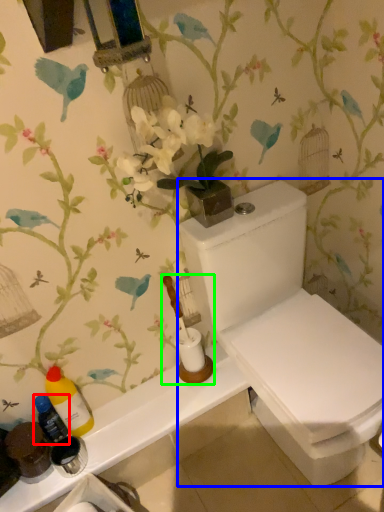
Question: Based on their relative distances, which object is nearer to bottle (highlighted by a red box)? Choose from toilet (highlighted by a blue box) and toiletries (highlighted by a green box).

Choices:
 (A) toilet
 (B) toiletries

Answer: (B)